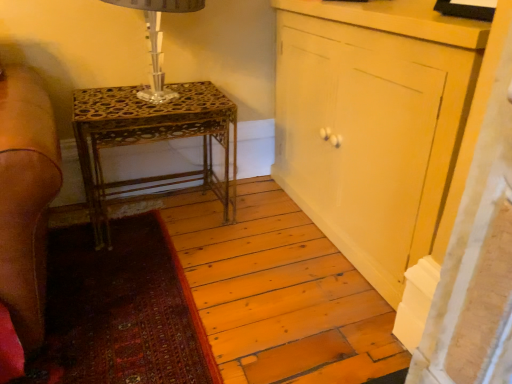
Question: In terms of size, does matte yellow cabinet at center appear bigger or smaller than gold metallic table at center?

Choices:
 (A) small
 (B) big

Answer: (B)

Question: Considering the positions of matte yellow cabinet at center and gold metallic table at center in the image, is matte yellow cabinet at center wider or thinner than gold metallic table at center?

Choices:
 (A) thin
 (B) wide

Answer: (A)

Question: Considering the real-world distances, which object is farthest from the clear glass table lamp at upper left?

Choices:
 (A) matte yellow cabinet at center
 (B) gold metallic table at center

Answer: (A)

Question: Which object is the farthest from the matte yellow cabinet at center?

Choices:
 (A) gold metallic table at center
 (B) clear glass table lamp at upper left

Answer: (B)